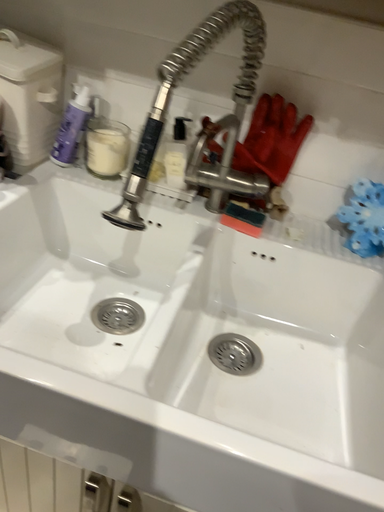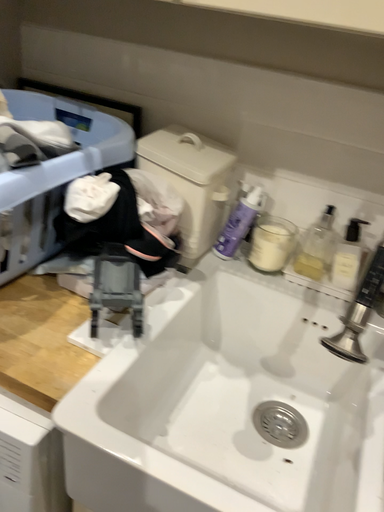
Question: How did the camera likely rotate when shooting the video?

Choices:
 (A) rotated downward
 (B) rotated upward

Answer: (B)